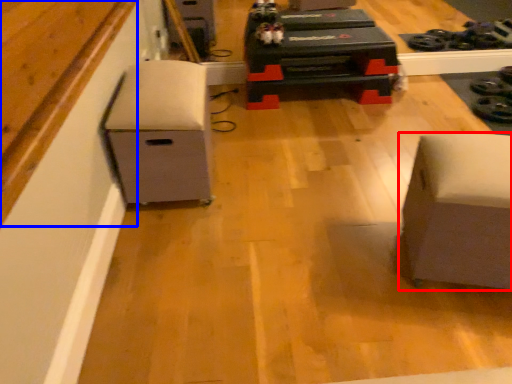
Question: Which of the following is the closest to the observer, furniture (highlighted by a red box) or wood (highlighted by a blue box)?

Choices:
 (A) furniture
 (B) wood

Answer: (B)